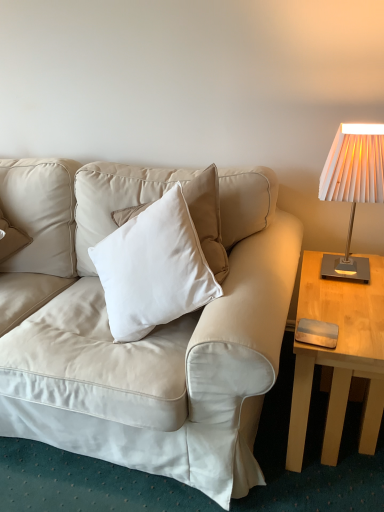
The width and height of the screenshot is (384, 512). In order to click on free space above light wood table at right (from a real-world perspective) in this screenshot , I will do `click(352, 291)`.